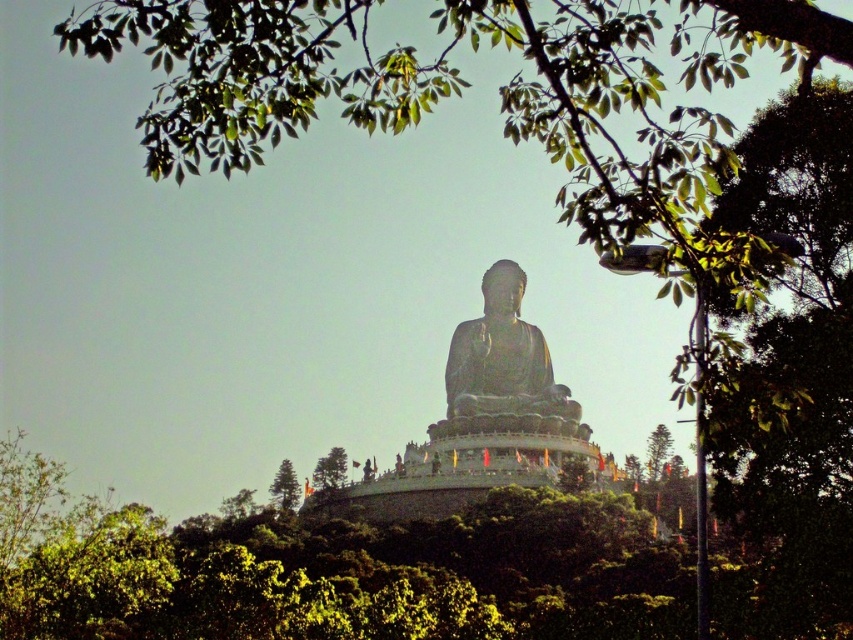
Question: Can you confirm if black polished stone buddha at center is positioned to the right of green leafy tree at center?

Choices:
 (A) no
 (B) yes

Answer: (B)

Question: Which of the following is the closest to the observer?

Choices:
 (A) green textured pine tree at center
 (B) green leafy tree at center

Answer: (B)

Question: Is green leafy tree at center to the left of green textured pine tree at center from the viewer's perspective?

Choices:
 (A) yes
 (B) no

Answer: (B)

Question: Is black polished stone buddha at center above green leafy tree at center?

Choices:
 (A) yes
 (B) no

Answer: (A)

Question: Which point is closer to the camera?

Choices:
 (A) black polished stone buddha at center
 (B) green textured pine tree at center

Answer: (A)

Question: Which point is closer to the camera?

Choices:
 (A) (294, 502)
 (B) (541, 432)
 (C) (340, 472)

Answer: (B)